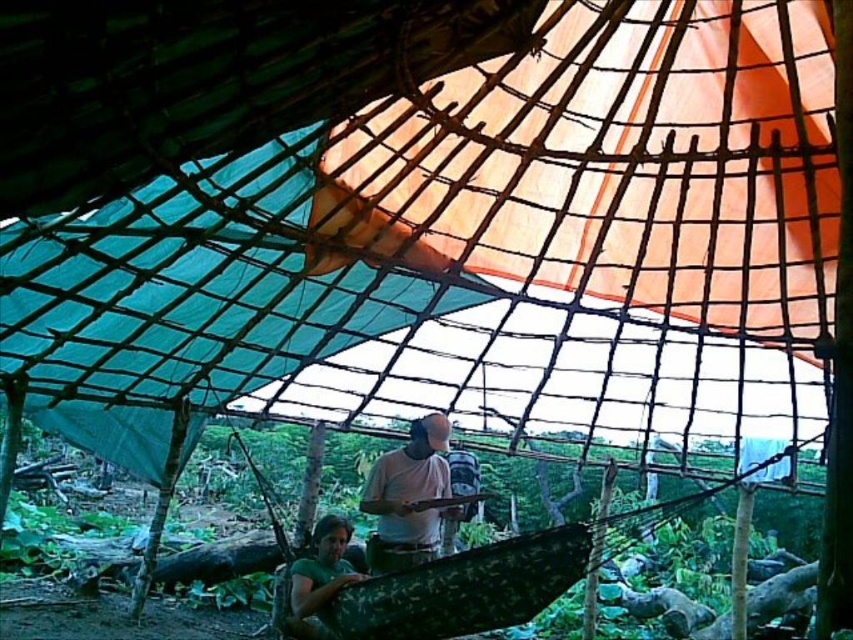
Question: Considering the relative positions of white cotton shirt at center and green matte shirt at lower center in the image provided, where is white cotton shirt at center located with respect to green matte shirt at lower center?

Choices:
 (A) right
 (B) left

Answer: (A)

Question: Can you confirm if white cotton shirt at center is positioned to the right of green matte shirt at lower center?

Choices:
 (A) no
 (B) yes

Answer: (B)

Question: Where is white cotton shirt at center located in relation to green matte shirt at lower center in the image?

Choices:
 (A) below
 (B) above

Answer: (B)

Question: Which point is closer to the camera?

Choices:
 (A) green matte shirt at lower center
 (B) white cotton shirt at center

Answer: (A)

Question: Which object is closer to the camera taking this photo?

Choices:
 (A) white cotton shirt at center
 (B) green matte shirt at lower center

Answer: (B)